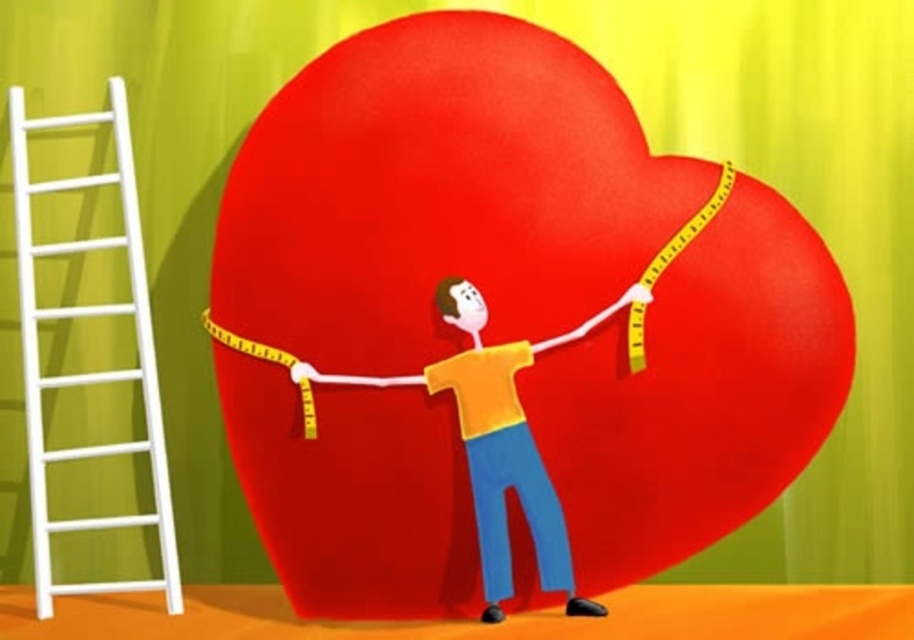
Which is more to the right, matte red heart at center or yellow matte shirt at center?

yellow matte shirt at center is more to the right.

Does matte red heart at center have a greater width compared to yellow matte shirt at center?

Yes.

Who is more distant from viewer, (339, 516) or (626, 296)?

The point (339, 516) is behind.

Find the location of a particular element. This screenshot has height=640, width=914. matte red heart at center is located at coordinates (503, 330).

Does matte red heart at center have a lesser width compared to white wooden ladder at left?

No.

Is matte red heart at center taller than white wooden ladder at left?

Yes, matte red heart at center is taller than white wooden ladder at left.

At what (x,y) coordinates should I click in order to perform the action: click on matte red heart at center. Please return your answer as a coordinate pair (x, y). Looking at the image, I should click on (503, 330).

Identify the location of matte red heart at center. (503, 330).

Measure the distance from white wooden ladder at left to yellow matte shirt at center.

A distance of 90.10 centimeters exists between white wooden ladder at left and yellow matte shirt at center.

Can you confirm if white wooden ladder at left is positioned below yellow matte shirt at center?

Incorrect, white wooden ladder at left is not positioned below yellow matte shirt at center.

Describe the element at coordinates (88, 372) in the screenshot. I see `white wooden ladder at left` at that location.

Image resolution: width=914 pixels, height=640 pixels. In order to click on white wooden ladder at left in this screenshot , I will do click(88, 372).